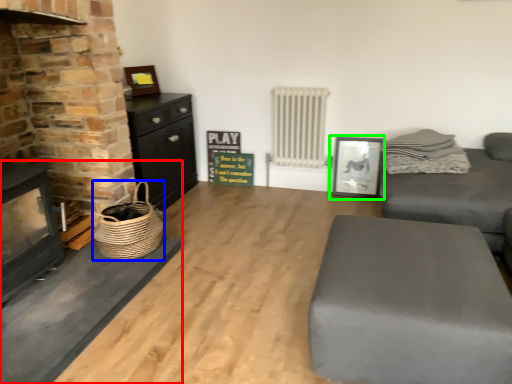
Question: Which is farther away from fireplace (highlighted by a red box)? basket (highlighted by a blue box) or picture frame (highlighted by a green box)?

Choices:
 (A) basket
 (B) picture frame

Answer: (B)